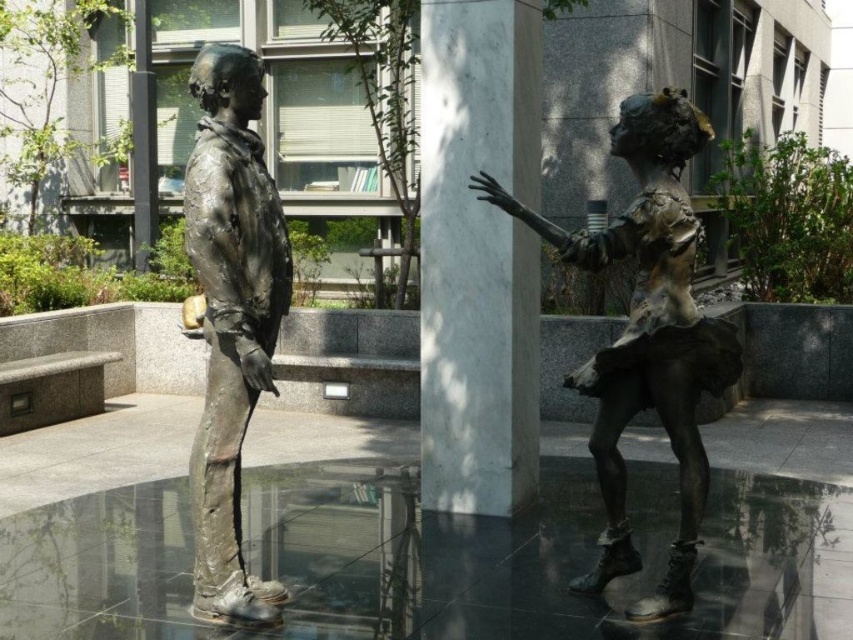
Question: Which of the following is the closest to the observer?

Choices:
 (A) bronze textured ballerina at center
 (B) bronze statue at center
 (C) white marble pillar at center

Answer: (B)

Question: Which point appears closest to the camera in this image?

Choices:
 (A) (601, 368)
 (B) (535, 109)
 (C) (192, 598)

Answer: (A)

Question: Can you confirm if white marble pillar at center is positioned above bronze textured ballerina at center?

Choices:
 (A) no
 (B) yes

Answer: (B)

Question: Is bronze textured ballerina at center wider than bronze statue at center?

Choices:
 (A) yes
 (B) no

Answer: (A)

Question: Estimate the real-world distances between objects in this image. Which object is closer to the bronze statue at center?

Choices:
 (A) white marble pillar at center
 (B) bronze textured ballerina at center

Answer: (B)

Question: From the image, what is the correct spatial relationship of white marble pillar at center in relation to bronze statue at center?

Choices:
 (A) right
 (B) left

Answer: (A)